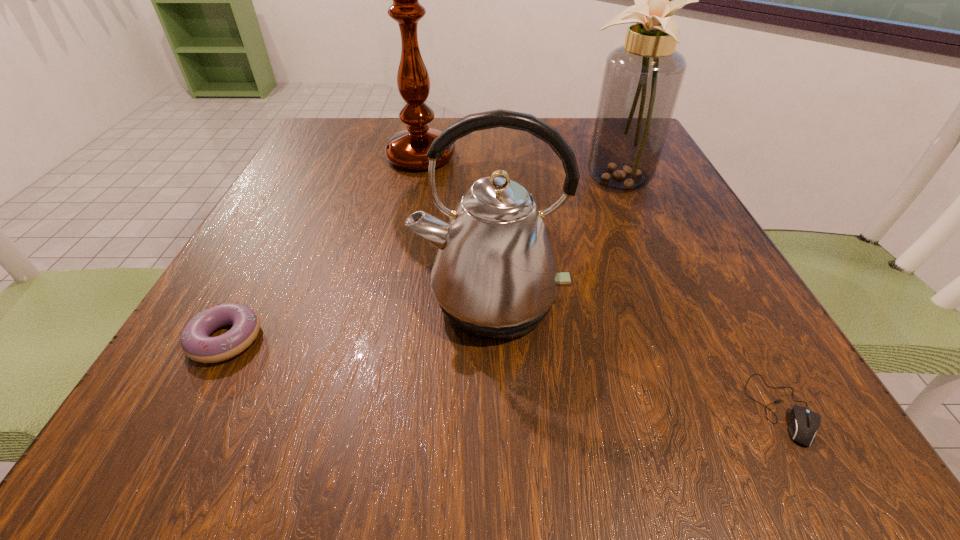
Find the location of `vacant space that satisfies the following two spatial constraints: 1. from the spout of the kettle; 2. on the right side of the nearest object`. vacant space that satisfies the following two spatial constraints: 1. from the spout of the kettle; 2. on the right side of the nearest object is located at coordinates (493, 409).

Where is `free point that satisfies the following two spatial constraints: 1. from the spout of the third tallest object; 2. on the right side of the shortest object`? The width and height of the screenshot is (960, 540). free point that satisfies the following two spatial constraints: 1. from the spout of the third tallest object; 2. on the right side of the shortest object is located at coordinates [x=493, y=409].

Identify the location of vacant area in the image that satisfies the following two spatial constraints: 1. from the spout of the nearest object; 2. on the right side of the kettle. (493, 409).